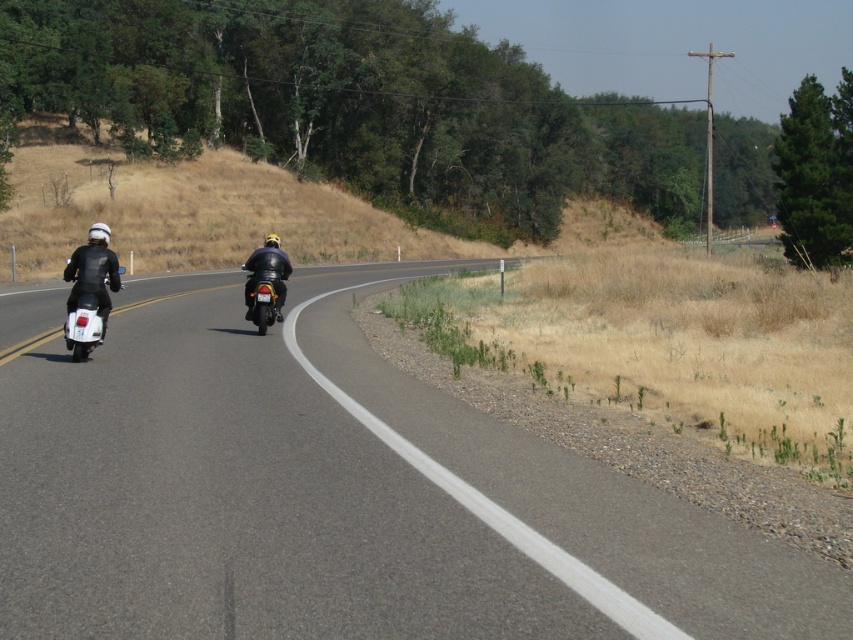
Who is more forward, (73, 464) or (254, 282)?

Point (73, 464)

Consider the image. Is asphalt road at center bigger than shiny black motorcycle at center?

Correct, asphalt road at center is larger in size than shiny black motorcycle at center.

Locate an element on the screen. asphalt road at center is located at coordinates (334, 493).

Which is in front, point (369, 612) or point (64, 332)?

Point (369, 612)

Is point (74, 440) positioned in front of point (82, 342)?

Yes, point (74, 440) is in front of point (82, 342).

Locate an element on the screen. The height and width of the screenshot is (640, 853). asphalt road at center is located at coordinates tap(334, 493).

Between shiny black motorcycle at center and shiny silver scooter at left, which one has less height?

shiny silver scooter at left is shorter.

Is point (252, 307) positioned after point (94, 339)?

Yes, it is behind point (94, 339).

Is point (245, 284) positioned before point (96, 321)?

No.

The image size is (853, 640). I want to click on shiny black motorcycle at center, so click(x=265, y=288).